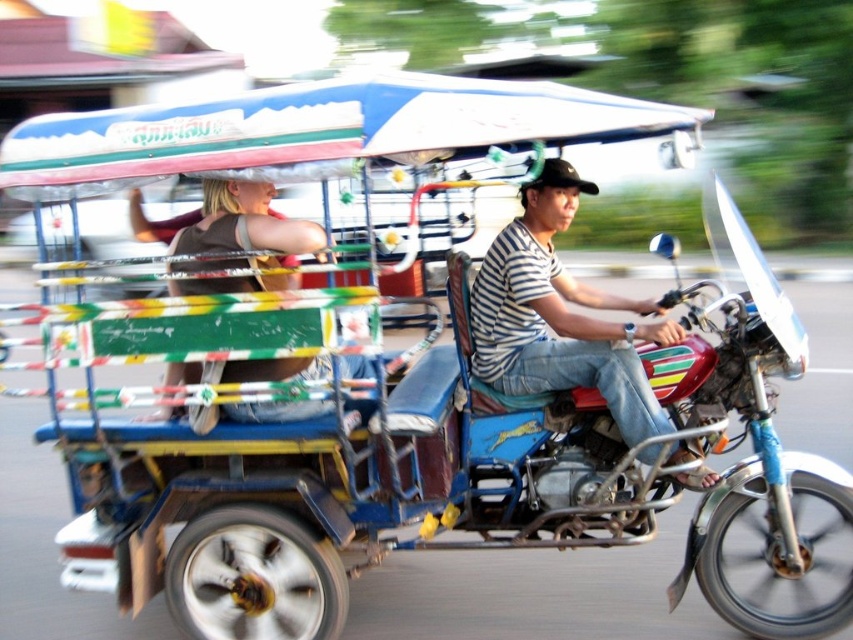
Is point (602, 307) closer to viewer compared to point (206, 182)?

No, (602, 307) is further to viewer.

Does point (479, 305) come in front of point (265, 224)?

No, (479, 305) is further to viewer.

In order to click on striped shirt at center in this screenshot , I will do `click(560, 316)`.

Can you confirm if metallic blue motorcycle at center is positioned to the left of striped shirt at center?

Yes, metallic blue motorcycle at center is to the left of striped shirt at center.

Between point (612, 436) and point (546, 353), which one is positioned behind?

The point (546, 353) is more distant.

Locate an element on the screen. Image resolution: width=853 pixels, height=640 pixels. metallic blue motorcycle at center is located at coordinates (341, 492).

Does metallic blue motorcycle at center have a lesser width compared to brown fabric shirt at left?

In fact, metallic blue motorcycle at center might be wider than brown fabric shirt at left.

Between metallic blue motorcycle at center and brown fabric shirt at left, which one is positioned lower?

metallic blue motorcycle at center is below.

Does point (430, 388) lie behind point (276, 289)?

Yes, point (430, 388) is behind point (276, 289).

In order to click on metallic blue motorcycle at center in this screenshot , I will do `click(341, 492)`.